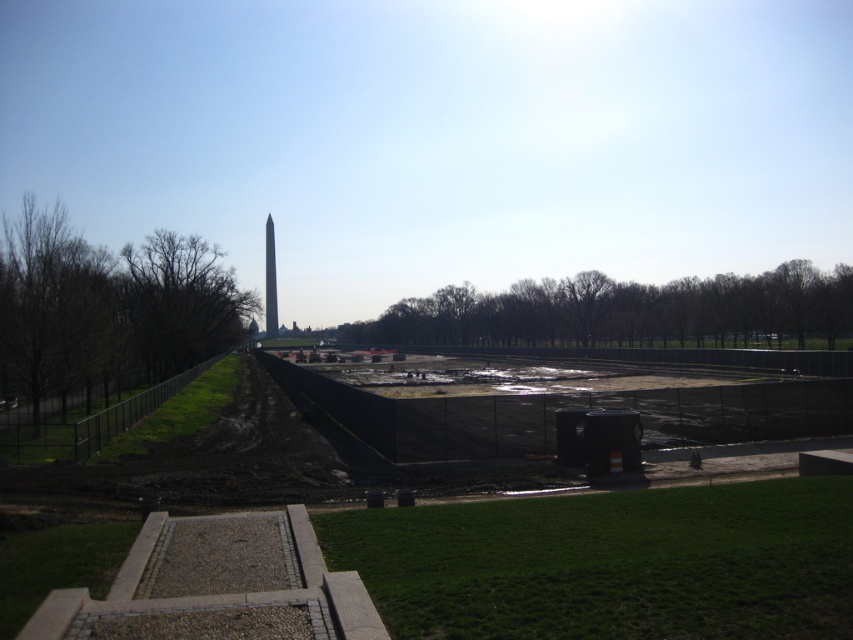
You are a city planner reviewing the urban landscape image. You need to determine if the black matte construction site at center can accommodate a new temporary storage unit that requires a space larger than the polished granite obelisk at center. Based on the image, is this possible?

The black matte construction site at center is smaller than the polished granite obelisk at center, so it cannot accommodate a storage unit requiring a space larger than the obelisk.